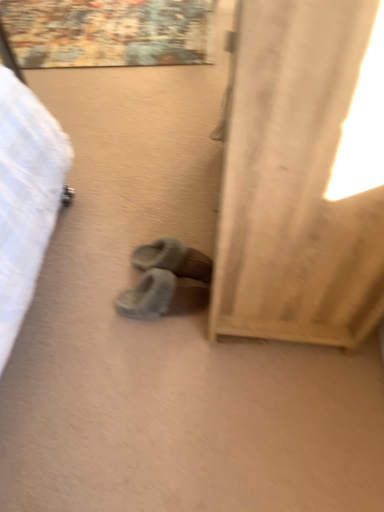
Question: From the image's perspective, does gray fuzzy slippers at center, placed as the 1th footwear when sorted from top to bottom, appear lower than beige fabric curtain at right?

Choices:
 (A) no
 (B) yes

Answer: (B)

Question: Can you see gray fuzzy slippers at center, placed as the 1th footwear when sorted from top to bottom, touching beige fabric curtain at right?

Choices:
 (A) yes
 (B) no

Answer: (B)

Question: Does gray fuzzy slippers at center, the 2th footwear from the bottom, have a larger size compared to beige fabric curtain at right?

Choices:
 (A) yes
 (B) no

Answer: (B)

Question: Is gray fuzzy slippers at center, placed as the 1th footwear when sorted from top to bottom, thinner than beige fabric curtain at right?

Choices:
 (A) yes
 (B) no

Answer: (A)

Question: Can you confirm if gray fuzzy slippers at center, placed as the 1th footwear when sorted from top to bottom, is smaller than beige fabric curtain at right?

Choices:
 (A) yes
 (B) no

Answer: (A)

Question: Based on their sizes in the image, would you say gray fuzzy slippers at center, the 2th footwear from the bottom, is bigger or smaller than fuzzy suede slippers at center, placed as the 2th footwear when sorted from top to bottom?

Choices:
 (A) big
 (B) small

Answer: (B)

Question: From a real-world perspective, is gray fuzzy slippers at center, the 2th footwear from the bottom, positioned above or below fuzzy suede slippers at center, the 1th footwear when ordered from bottom to top?

Choices:
 (A) below
 (B) above

Answer: (B)

Question: Is gray fuzzy slippers at center, the 2th footwear from the bottom, wider or thinner than fuzzy suede slippers at center, placed as the 2th footwear when sorted from top to bottom?

Choices:
 (A) wide
 (B) thin

Answer: (A)

Question: From the image's perspective, relative to fuzzy suede slippers at center, placed as the 2th footwear when sorted from top to bottom, is gray fuzzy slippers at center, placed as the 1th footwear when sorted from top to bottom, above or below?

Choices:
 (A) above
 (B) below

Answer: (A)

Question: Is beige fabric curtain at right taller or shorter than fuzzy suede slippers at center, the 1th footwear when ordered from bottom to top?

Choices:
 (A) short
 (B) tall

Answer: (B)

Question: Is beige fabric curtain at right spatially inside fuzzy suede slippers at center, the 1th footwear when ordered from bottom to top, or outside of it?

Choices:
 (A) inside
 (B) outside

Answer: (B)

Question: Is beige fabric curtain at right in front of or behind fuzzy suede slippers at center, the 1th footwear when ordered from bottom to top, in the image?

Choices:
 (A) behind
 (B) front

Answer: (B)

Question: Considering the positions of beige fabric curtain at right and fuzzy suede slippers at center, placed as the 2th footwear when sorted from top to bottom, in the image, is beige fabric curtain at right wider or thinner than fuzzy suede slippers at center, placed as the 2th footwear when sorted from top to bottom,?

Choices:
 (A) thin
 (B) wide

Answer: (B)

Question: Based on their positions, is beige fabric curtain at right located to the left or right of gray fuzzy slippers at center, the 2th footwear from the bottom?

Choices:
 (A) left
 (B) right

Answer: (B)

Question: Is beige fabric curtain at right bigger or smaller than gray fuzzy slippers at center, the 2th footwear from the bottom?

Choices:
 (A) big
 (B) small

Answer: (A)